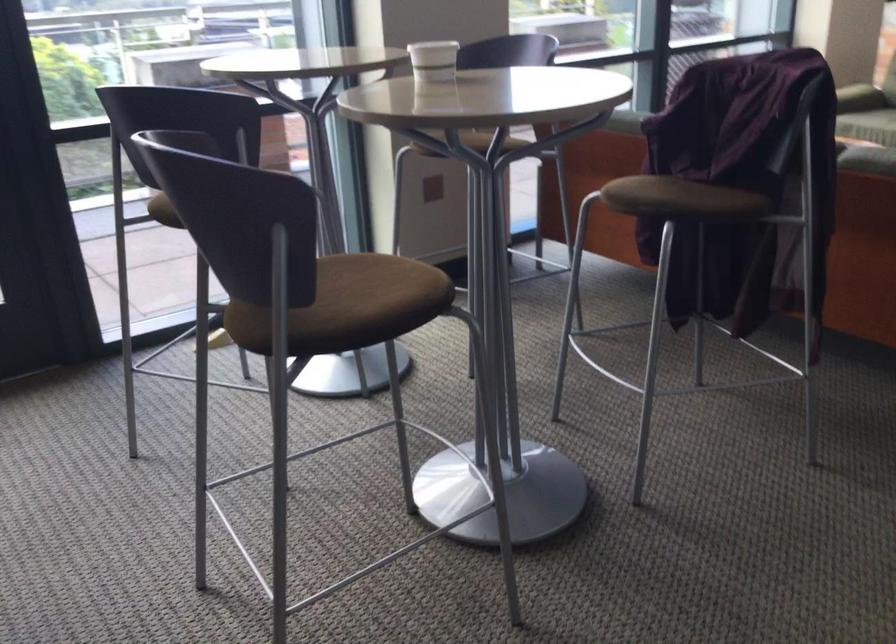
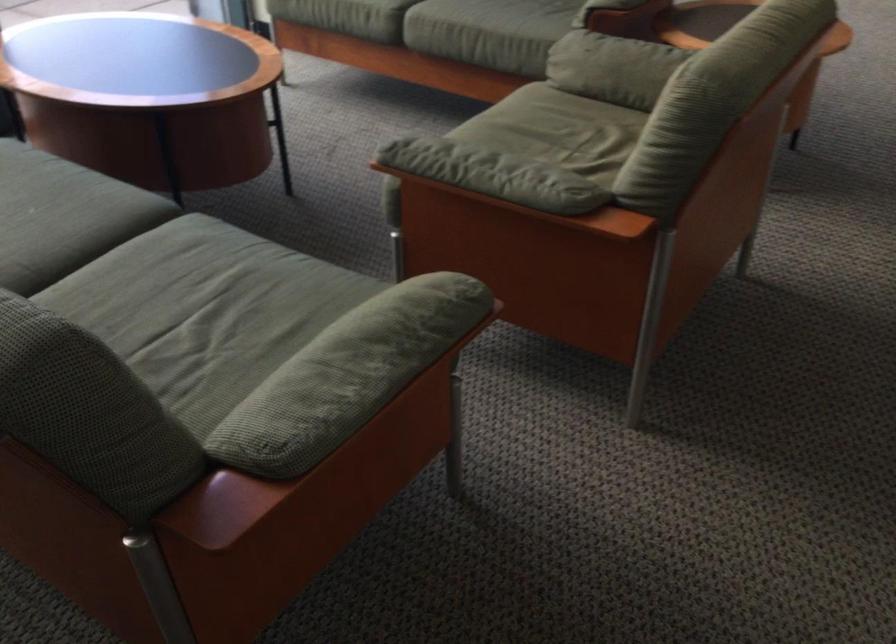
The images are taken continuously from a first-person perspective. In which direction are you moving?

The movement direction of the cameraman is right, forward.